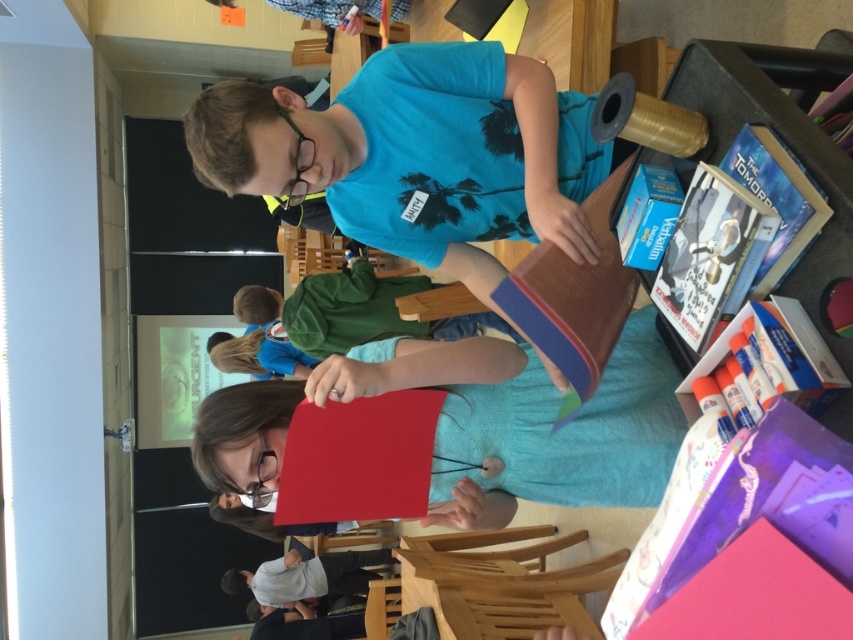
Can you confirm if smooth red paper at center is wider than light gray cotton shirt at lower center?

Incorrect, smooth red paper at center's width does not surpass light gray cotton shirt at lower center's.

Who is more forward, [592,412] or [287,552]?

Point [592,412] is more forward.

At what (x,y) coordinates should I click in order to perform the action: click on smooth red paper at center. Please return your answer as a coordinate pair (x, y). This screenshot has width=853, height=640. Looking at the image, I should click on (473, 424).